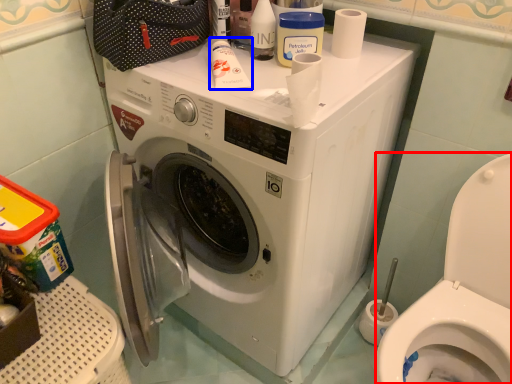
Question: Which of the following is the closest to the observer, bidet (highlighted by a red box) or toiletry (highlighted by a blue box)?

Choices:
 (A) bidet
 (B) toiletry

Answer: (A)